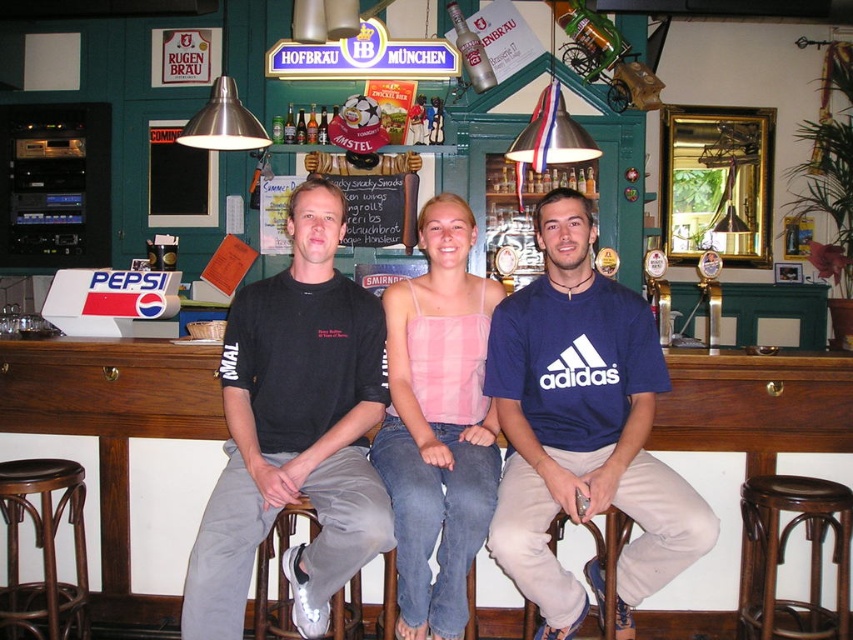
Question: Which point is closer to the camera?

Choices:
 (A) brown woven wood bar stool at lower left
 (B) blue cotton t-shirt at center
 (C) brown wooden bar stool at lower center
 (D) white leather bar stool at lower center

Answer: (B)

Question: Which of these objects is positioned farthest from the brown woven wood bar stool at lower left?

Choices:
 (A) black chalkboard at center
 (B) brown wooden stool at lower right
 (C) brown wooden bar stool at lower center

Answer: (A)

Question: Which point is farther to the camera?

Choices:
 (A) brown wooden bar stool at lower center
 (B) pink fabric tank top at center
 (C) black cotton t-shirt at center

Answer: (A)

Question: Observing the image, what is the correct spatial positioning of white leather bar stool at lower center in reference to black chalkboard at center?

Choices:
 (A) right
 (B) left

Answer: (B)

Question: Can you confirm if brown wooden stool at lower right is wider than black chalkboard at center?

Choices:
 (A) yes
 (B) no

Answer: (B)

Question: Is pink fabric tank top at center behind brown wooden bar stool at lower center?

Choices:
 (A) no
 (B) yes

Answer: (A)